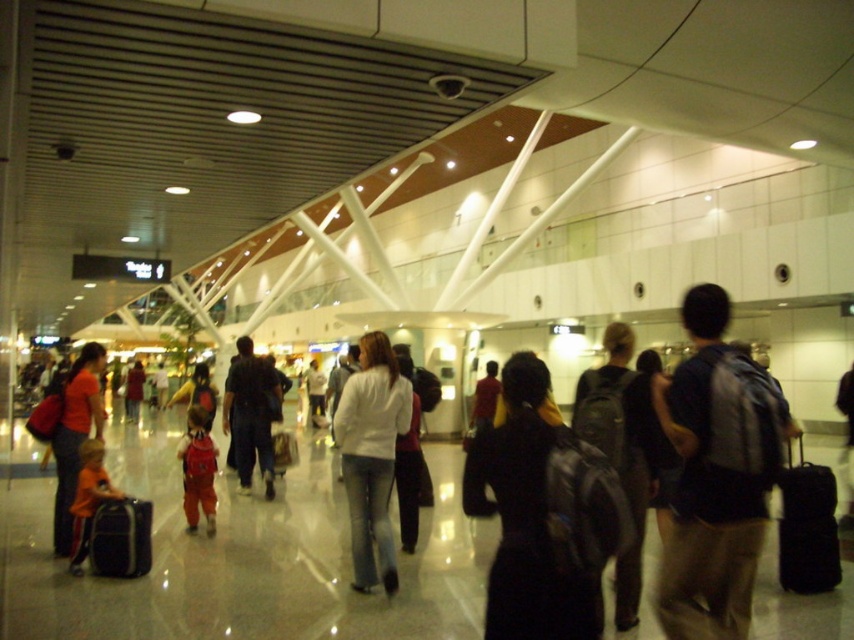
Can you confirm if white matte jacket at center is thinner than orange fabric child at center?

No, white matte jacket at center is not thinner than orange fabric child at center.

Locate an element on the screen. white matte jacket at center is located at coordinates (371, 456).

Which is above, black matte backpack at center or black fabric suitcase at lower left?

black matte backpack at center is higher up.

Based on the photo, between black matte backpack at center and black fabric suitcase at lower left, which one has more height?

black matte backpack at center is taller.

Does point (496, 428) come behind point (117, 568)?

No, it is not.

Where is `black matte backpack at center`? The width and height of the screenshot is (854, 640). black matte backpack at center is located at coordinates (527, 518).

Between point (197, 509) and point (79, 516), which one is positioned behind?

The point (197, 509) is more distant.

Is point (199, 433) positioned behind point (104, 496)?

Yes, point (199, 433) is behind point (104, 496).

This screenshot has width=854, height=640. In order to click on red fabric child at center in this screenshot , I will do coord(197,468).